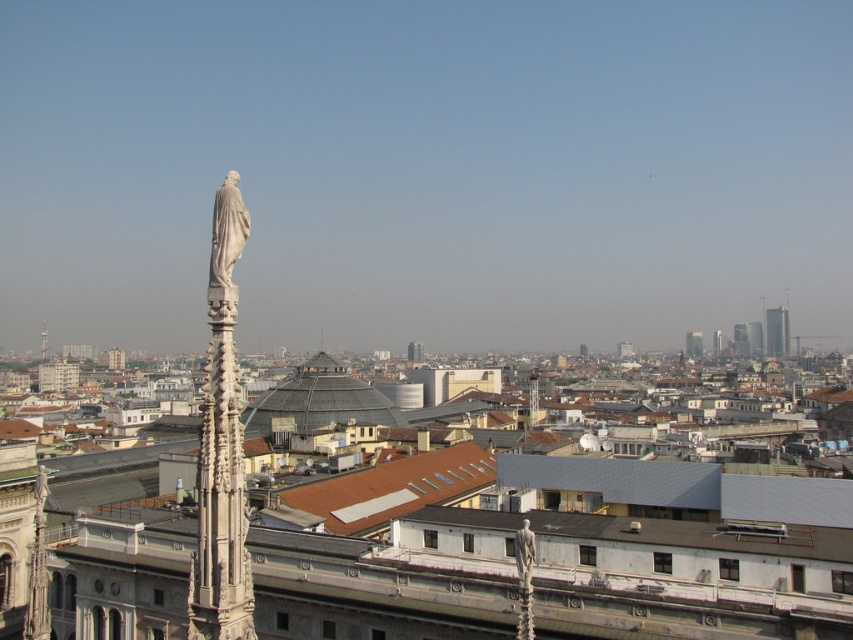
Question: Is matte gray tower at center further to the viewer compared to white stone spire at left?

Choices:
 (A) yes
 (B) no

Answer: (B)

Question: Which point appears closest to the camera in this image?

Choices:
 (A) (418, 346)
 (B) (44, 339)
 (C) (241, 637)

Answer: (C)

Question: Considering the relative positions of white marble statue at left and matte white tower at center in the image provided, where is white marble statue at left located with respect to matte white tower at center?

Choices:
 (A) left
 (B) right

Answer: (B)

Question: Is white marble statue at left bigger than smooth glass skyscraper at right?

Choices:
 (A) yes
 (B) no

Answer: (B)

Question: Which of the following is the closest to the observer?

Choices:
 (A) (697, 342)
 (B) (764, 330)
 (C) (206, 387)
 (D) (39, 356)

Answer: (C)

Question: Which of the following is the farthest from the observer?

Choices:
 (A) smooth glass skyscraper at right
 (B) white marble statue at left

Answer: (A)